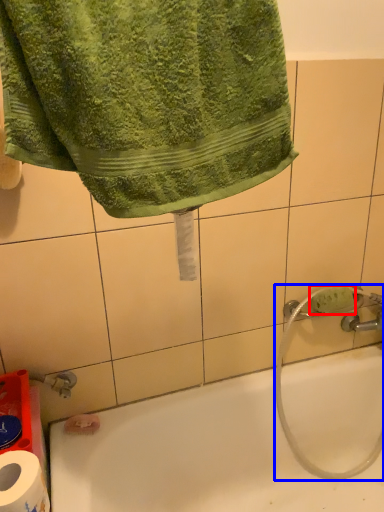
Question: Which of the following is the farthest to the observer, soap (highlighted by a red box) or garden hose (highlighted by a blue box)?

Choices:
 (A) soap
 (B) garden hose

Answer: (A)